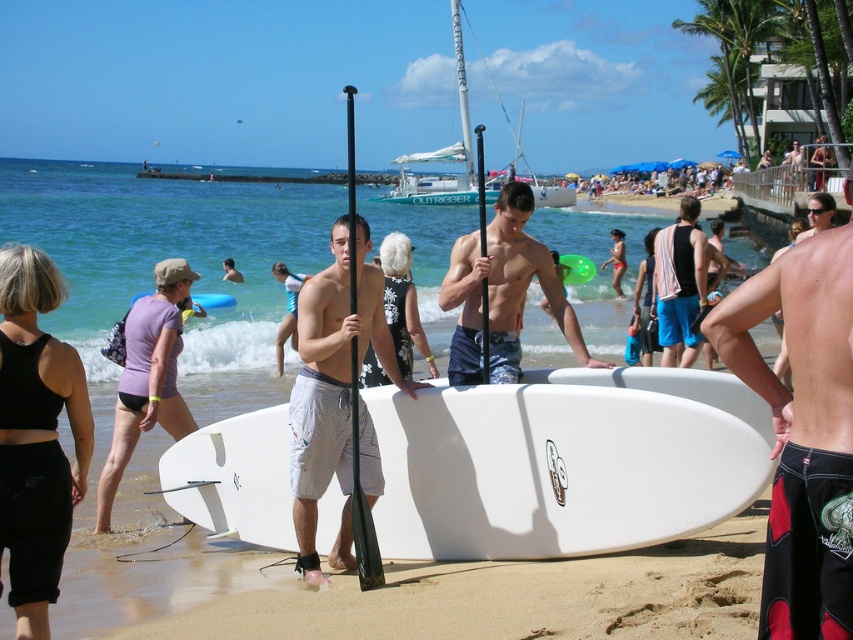
Can you confirm if white smooth surfboard at center is positioned above matte blue shorts at center?

→ No.

Is white smooth surfboard at center to the right of matte blue shorts at center from the viewer's perspective?

Incorrect, white smooth surfboard at center is not on the right side of matte blue shorts at center.

Is point (268, 433) less distant than point (445, 276)?

Yes, it is in front of point (445, 276).

Locate an element on the screen. This screenshot has width=853, height=640. white smooth surfboard at center is located at coordinates (566, 461).

Can you confirm if black textured board shorts at center is positioned above matte blue shorts at center?

Incorrect, black textured board shorts at center is not positioned above matte blue shorts at center.

Does black textured board shorts at center appear on the left side of matte blue shorts at center?

In fact, black textured board shorts at center is to the right of matte blue shorts at center.

Measure the distance between black textured board shorts at center and camera.

They are 3.02 meters apart.

Where is `black textured board shorts at center`? black textured board shorts at center is located at coordinates (802, 429).

Between point (704, 419) and point (35, 600), which one is positioned behind?

The point (704, 419) is behind.

The height and width of the screenshot is (640, 853). What do you see at coordinates (566, 461) in the screenshot?
I see `white smooth surfboard at center` at bounding box center [566, 461].

This screenshot has width=853, height=640. I want to click on white smooth surfboard at center, so click(566, 461).